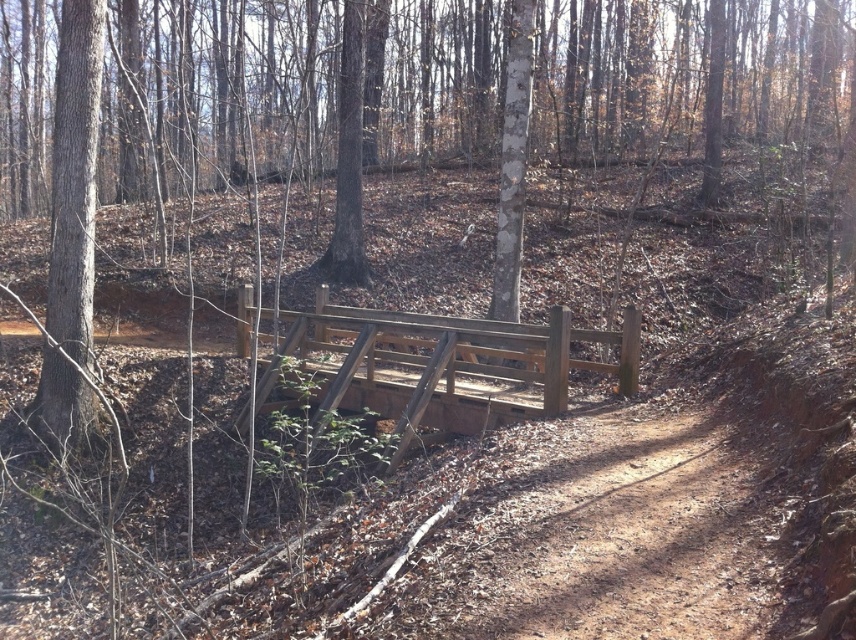
Who is higher up, smooth brown tree trunk at left or smooth brown tree at center?

smooth brown tree at center is above.

Is smooth brown tree trunk at left shorter than smooth brown tree at center?

Yes.

Which is behind, point (82, 132) or point (339, 108)?

Positioned behind is point (339, 108).

Where is `smooth brown tree trunk at left`? This screenshot has width=856, height=640. smooth brown tree trunk at left is located at coordinates (70, 230).